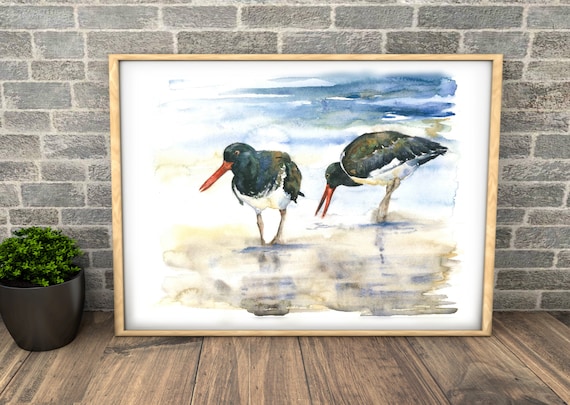
You are a GUI agent. You are given a task and a screenshot of the screen. Output one action in this format:
    pyautogui.click(x=<x>, y=<y>)
    Task: Click on the pot
    The width and height of the screenshot is (570, 405).
    Given the screenshot: What is the action you would take?
    pyautogui.click(x=46, y=314)